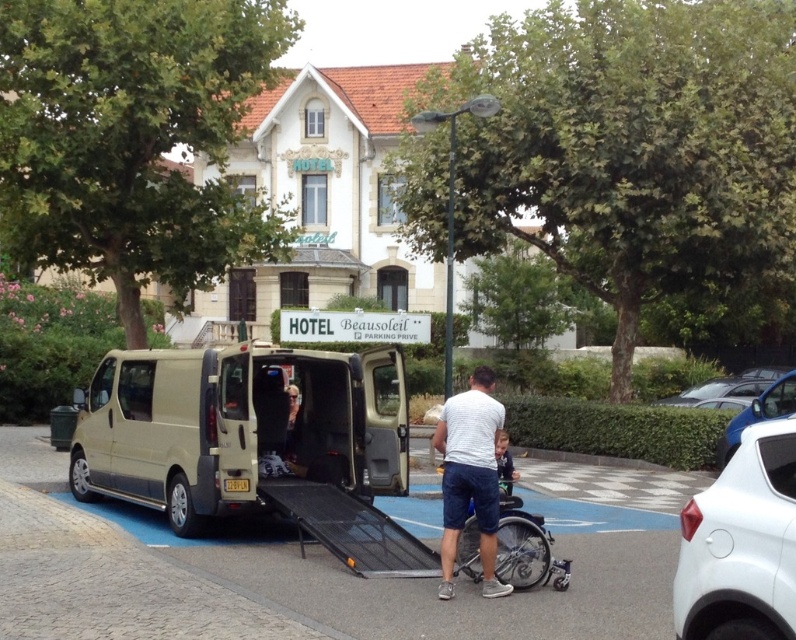
Who is lower down, white glossy car at right or light blue fabric wheelchair at lower center?

light blue fabric wheelchair at lower center

Locate an element on the screen. The width and height of the screenshot is (796, 640). white glossy car at right is located at coordinates (759, 413).

Image resolution: width=796 pixels, height=640 pixels. I want to click on white glossy car at right, so point(759,413).

Which is above, beige metallic van at center or white glossy car at lower right?

beige metallic van at center is higher up.

Can you confirm if beige metallic van at center is bigger than white glossy car at lower right?

No.

What are the coordinates of `beige metallic van at center` in the screenshot? It's located at (237, 426).

In order to click on beige metallic van at center in this screenshot , I will do [237, 426].

Which is in front, point (498, 516) or point (736, 442)?

Point (498, 516)

Is silver metallic wheelchair at lower center to the right of white glossy car at right from the viewer's perspective?

No, silver metallic wheelchair at lower center is not to the right of white glossy car at right.

At what (x,y) coordinates should I click in order to perform the action: click on silver metallic wheelchair at lower center. Please return your answer as a coordinate pair (x, y). The height and width of the screenshot is (640, 796). Looking at the image, I should click on (525, 548).